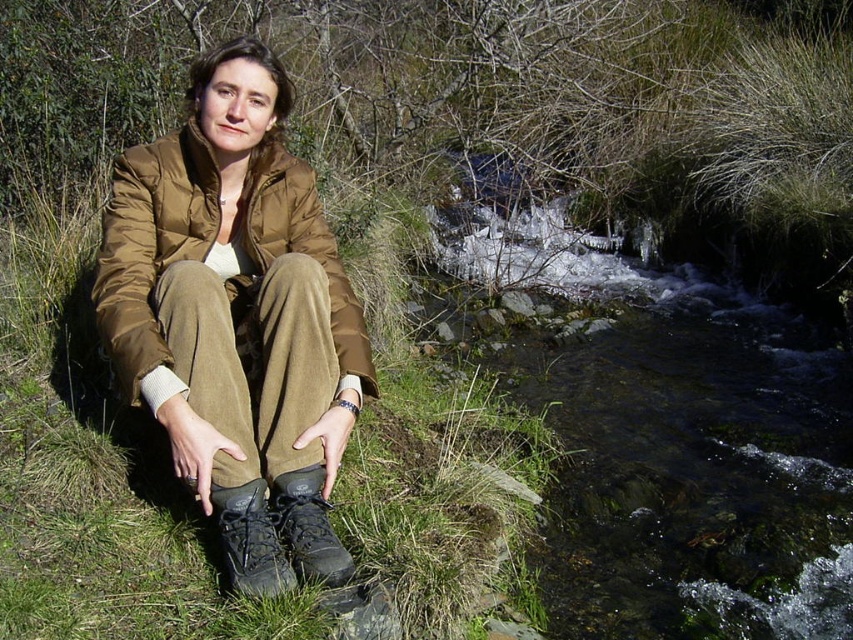
Question: Is matte brown jacket at center smaller than leather boot at lower center?

Choices:
 (A) yes
 (B) no

Answer: (B)

Question: Estimate the real-world distances between objects in this image. Which object is farther from the leather boot at lower center?

Choices:
 (A) clear water at center
 (B) khaki corduroy pants at center
 (C) matte brown jacket at center
 (D) dark grey leather boot at lower center

Answer: (A)

Question: Can you confirm if green soft grass at center is positioned to the right of leather boot at lower center?

Choices:
 (A) yes
 (B) no

Answer: (B)

Question: Is green soft grass at center bigger than khaki corduroy pants at center?

Choices:
 (A) yes
 (B) no

Answer: (A)

Question: Estimate the real-world distances between objects in this image. Which object is farther from the matte brown jacket at center?

Choices:
 (A) khaki corduroy pants at center
 (B) green soft grass at center
 (C) leather boot at lower center

Answer: (B)

Question: Which point is closer to the camera taking this photo?

Choices:
 (A) (134, 468)
 (B) (225, 348)
 (C) (840, 593)
 (D) (274, 593)

Answer: (D)